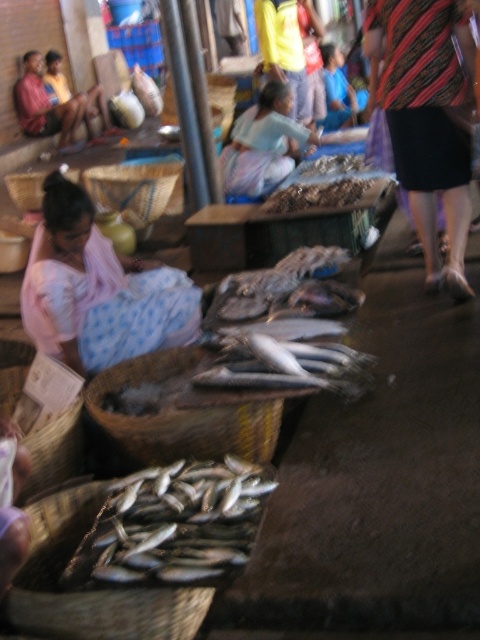
You are a customer at the fish market and want to pick up the brown woven basket at lower left and the light blue fabric at center. Which object should you reach for first to grab both without moving your position?

You should reach for the brown woven basket at lower left first since it is closer to you than the light blue fabric at center, allowing you to grab both items without moving your position.

Please look at the image and locate the brown woven basket at lower left. What are its coordinates on the image?

The brown woven basket at lower left is located at coordinates point (91, 589).

From the picture: You are a customer at the fish market and want to buy the silvery metallic fish at lower left and the light blue fabric at center. Which item is shorter in height?

The silvery metallic fish at lower left is shorter than the light blue fabric at center.